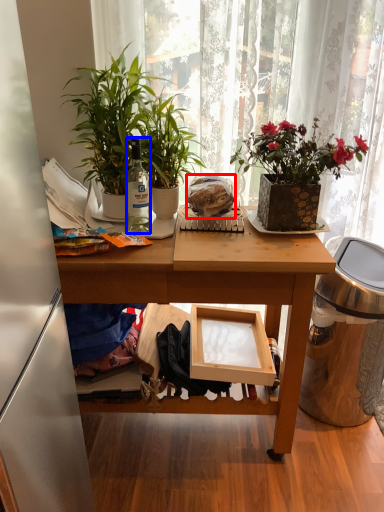
Question: Which of the following is the closest to the observer, food (highlighted by a red box) or bottle (highlighted by a blue box)?

Choices:
 (A) food
 (B) bottle

Answer: (B)